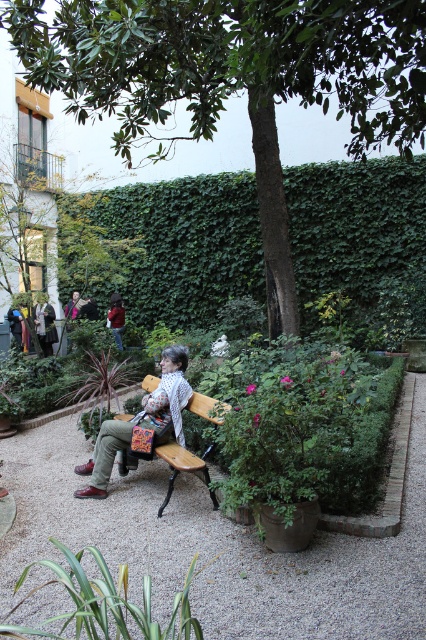
You are a visitor in the garden and want to place the matte brown leather jacket at center on the wooden bench at center. Can you do this without the jacket falling off?

The matte brown leather jacket at center is taller than the wooden bench at center, so placing it on the bench may cause the jacket to hang off the edges or not sit stably. It might be better to find a larger bench or another surface that can accommodate its height.

You are an observer standing in the garden and see the green ivy hedge at center and the matte brown leather jacket at center. Which object is taller?

The green ivy hedge at center is taller than the matte brown leather jacket at center.